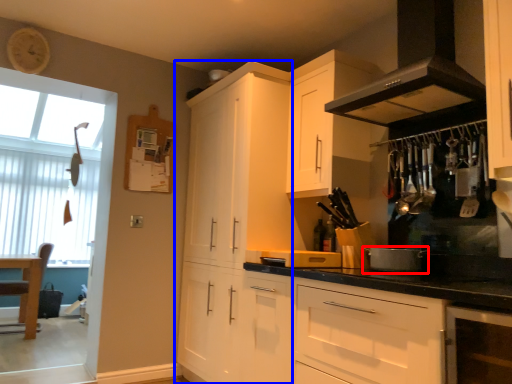
Question: Which point is further to the camera, appliance (highlighted by a red box) or cabinetry (highlighted by a blue box)?

Choices:
 (A) appliance
 (B) cabinetry

Answer: (B)